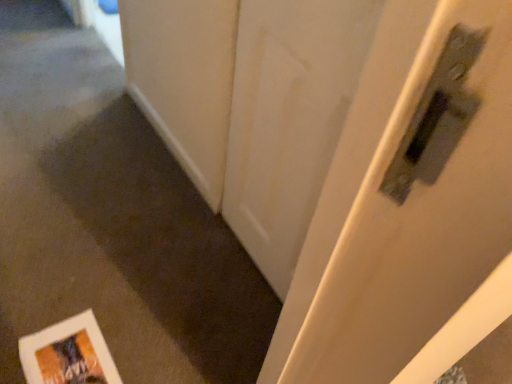
What do you see at coordinates (68, 354) in the screenshot? I see `matte paper magazine at lower left` at bounding box center [68, 354].

Where is `matte paper magazine at lower left`? The width and height of the screenshot is (512, 384). matte paper magazine at lower left is located at coordinates (68, 354).

The width and height of the screenshot is (512, 384). I want to click on matte paper magazine at lower left, so click(68, 354).